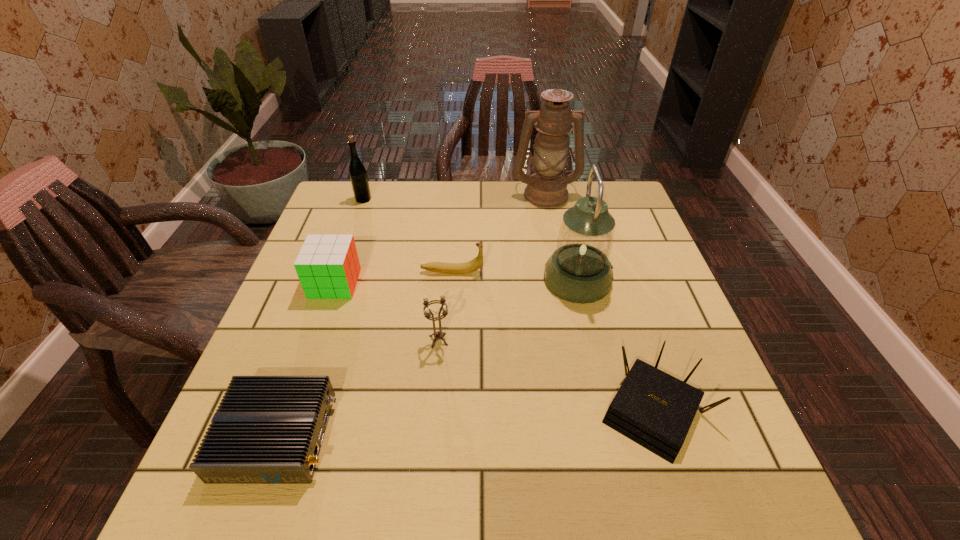
I want to click on cube at the left edge, so click(x=328, y=267).

At what (x,y) coordinates should I click in order to perform the action: click on router that is at the left edge. Please return your answer as a coordinate pair (x, y). This screenshot has height=540, width=960. Looking at the image, I should click on (267, 429).

Identify the location of oil lamp at the right edge. This screenshot has width=960, height=540. (546, 188).

I want to click on lantern that is at the right edge, so click(579, 271).

This screenshot has width=960, height=540. Find the location of `router located at the right edge`. router located at the right edge is located at coordinates (652, 408).

Where is `object located in the far left corner section of the desktop`? The width and height of the screenshot is (960, 540). object located in the far left corner section of the desktop is located at coordinates (358, 175).

The height and width of the screenshot is (540, 960). I want to click on object positioned at the near left corner, so click(x=267, y=429).

The image size is (960, 540). Find the location of `object located in the far right corner section of the desktop`. object located in the far right corner section of the desktop is located at coordinates coord(546,188).

Where is `object at the near right corner`? The height and width of the screenshot is (540, 960). object at the near right corner is located at coordinates (652, 408).

At what (x,y) coordinates should I click in order to perform the action: click on free location at the far edge. Please return your answer as a coordinate pair (x, y). The height and width of the screenshot is (540, 960). Looking at the image, I should click on (564, 205).